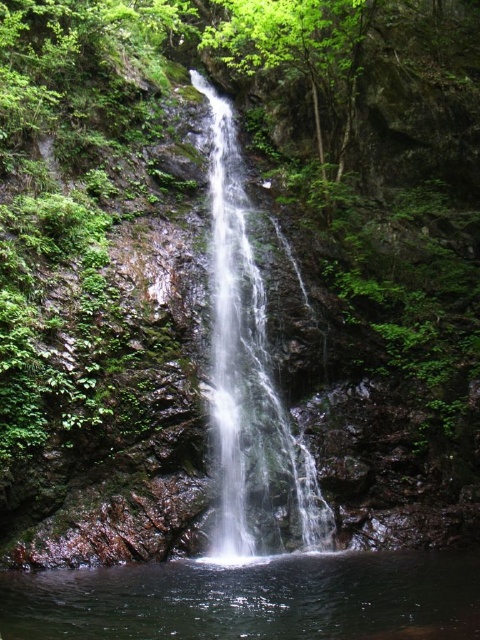
Is clear liquid water at bottom center bigger than clear water at center?

Incorrect, clear liquid water at bottom center is not larger than clear water at center.

Does clear liquid water at bottom center have a lesser height compared to clear water at center?

Yes, clear liquid water at bottom center is shorter than clear water at center.

This screenshot has height=640, width=480. Describe the element at coordinates (252, 600) in the screenshot. I see `clear liquid water at bottom center` at that location.

The image size is (480, 640). I want to click on clear liquid water at bottom center, so point(252,600).